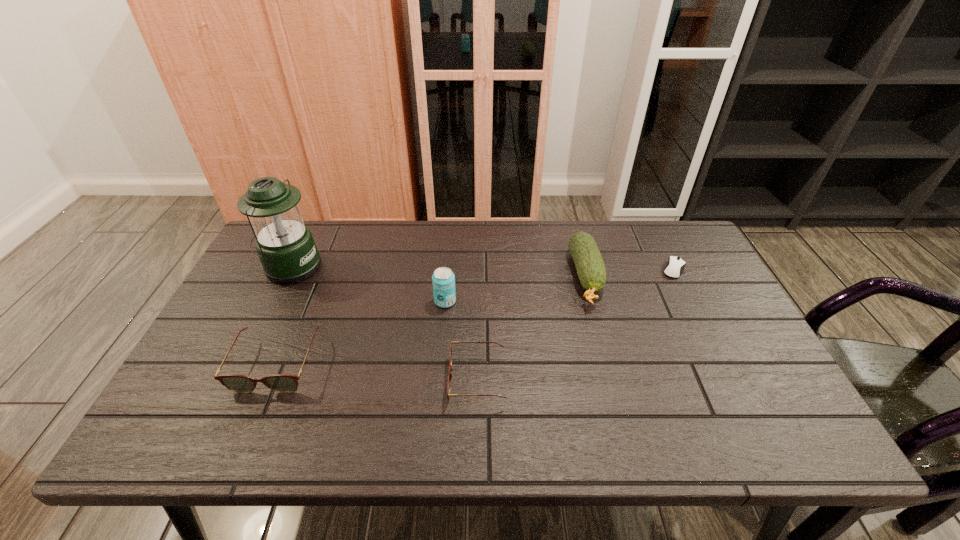
In the current image, all spectacless are evenly spaced. To maintain this equal spacing, where should an additional spectacles be placed on the right? Please point out a free spot. Please provide its 2D coordinates. Your answer should be formatted as a tuple, i.e. [(x, y)], where the tuple contains the x and y coordinates of a point satisfying the conditions above.

[(691, 396)]